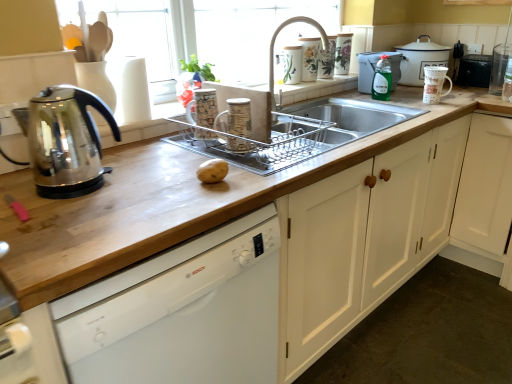
The width and height of the screenshot is (512, 384). What are the coordinates of `vacant space that is to the left of brown matte potato at center` in the screenshot? It's located at (153, 175).